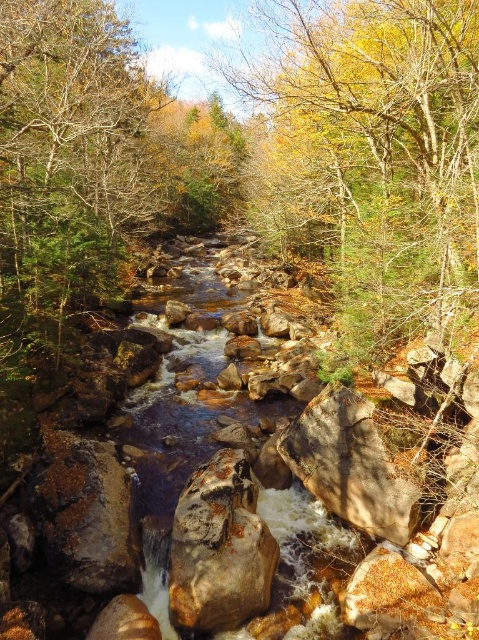
You are a hiker trying to cross the stream. You see a brown wood tree at center and a brown rough rock at center. Which one is wider? Please choose between the two.

The brown wood tree at center is wider than the brown rough rock at center.